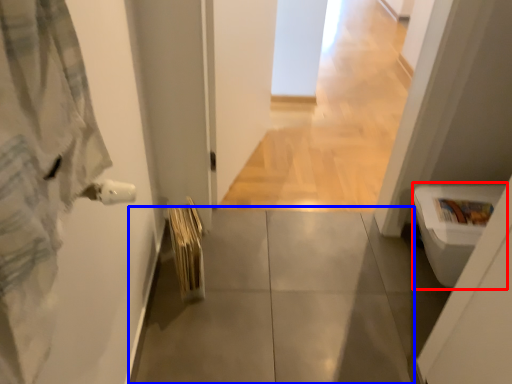
Question: Among these objects, which one is farthest to the camera, toilet bowl (highlighted by a red box) or concrete (highlighted by a blue box)?

Choices:
 (A) toilet bowl
 (B) concrete

Answer: (B)